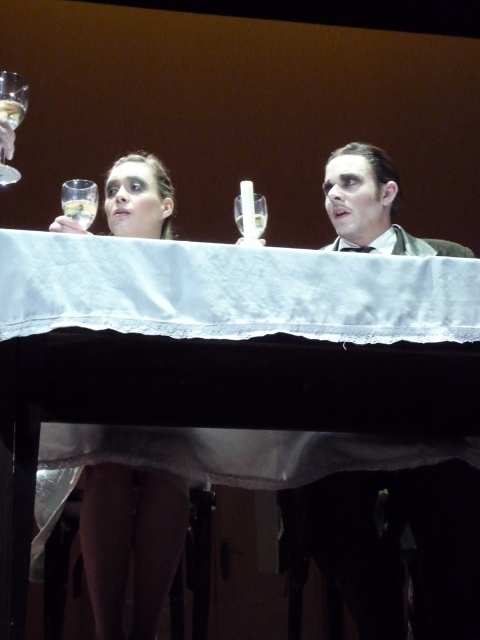
Question: Which of the following is the farthest from the observer?

Choices:
 (A) clear glass wine glass at left
 (B) clear glass wine glass at upper left
 (C) clear glass wine glass at center
 (D) white cloth-covered table at center

Answer: (C)

Question: Observing the image, what is the correct spatial positioning of clear glass wine glass at upper left in reference to clear glass wine glass at left?

Choices:
 (A) above
 (B) below

Answer: (A)

Question: Can you confirm if white cloth-covered table at center is positioned above clear glass wine glass at left?

Choices:
 (A) no
 (B) yes

Answer: (A)

Question: Based on their relative distances, which object is nearer to the clear glass wine glass at upper left?

Choices:
 (A) white cloth-covered table at center
 (B) clear glass wine glass at left
 (C) clear glass wine glass at center

Answer: (B)

Question: Which object is positioned farthest from the clear glass wine glass at upper left?

Choices:
 (A) clear glass wine glass at center
 (B) clear glass wine glass at left
 (C) white cloth-covered table at center

Answer: (C)

Question: Can you confirm if white cloth-covered table at center is thinner than clear glass wine glass at center?

Choices:
 (A) no
 (B) yes

Answer: (A)